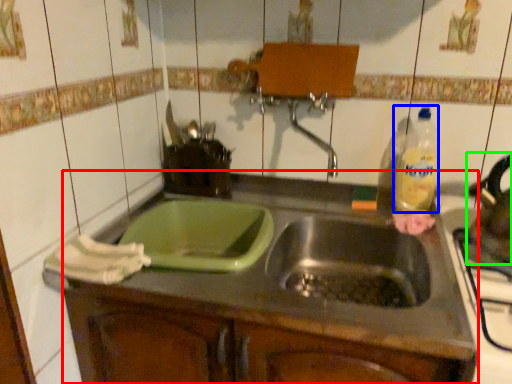
Question: Estimate the real-world distances between objects in this image. Which object is farther from countertop (highlighted by a red box), bottle (highlighted by a blue box) or tea pot (highlighted by a green box)?

Choices:
 (A) bottle
 (B) tea pot

Answer: (B)